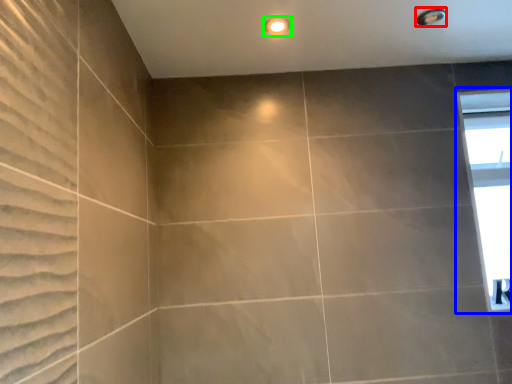
Question: Which object is positioned farthest from shower (highlighted by a red box)? Select from window (highlighted by a blue box) and lighting (highlighted by a green box).

Choices:
 (A) window
 (B) lighting

Answer: (A)